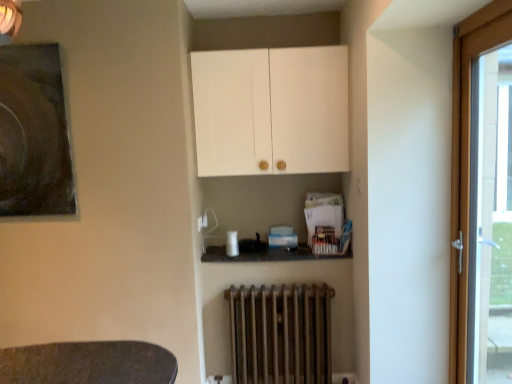
Measure the distance between dark matte painting at upper left and camera.

The distance of dark matte painting at upper left from camera is 7.33 feet.

In order to face rusty metal radiator at lower center, should I rotate leftwards or rightwards?

To align with it, rotate right about 3.390°.

What do you see at coordinates (281, 334) in the screenshot?
I see `rusty metal radiator at lower center` at bounding box center [281, 334].

Image resolution: width=512 pixels, height=384 pixels. What do you see at coordinates (271, 111) in the screenshot?
I see `white matte cabinet at upper center` at bounding box center [271, 111].

Image resolution: width=512 pixels, height=384 pixels. Identify the location of dark matte painting at upper left. (34, 134).

Is white matte cabinet at upper center facing towards dark matte painting at upper left?

No, white matte cabinet at upper center is not facing towards dark matte painting at upper left.

Would you say dark matte painting at upper left is part of white matte cabinet at upper center's contents?

No, dark matte painting at upper left is not surrounded by white matte cabinet at upper center.

From a real-world perspective, does white matte cabinet at upper center stand above dark matte painting at upper left?

Yes.

From the image's perspective, is white matte cabinet at upper center positioned above or below dark matte painting at upper left?

white matte cabinet at upper center is situated higher than dark matte painting at upper left in the image.

Is white matte cabinet at upper center positioned with its back to rusty metal radiator at lower center?

No, white matte cabinet at upper center is not facing the opposite direction of rusty metal radiator at lower center.

Where is `cabinetry above the rusty metal radiator at lower center (from the image's perspective)`? The height and width of the screenshot is (384, 512). cabinetry above the rusty metal radiator at lower center (from the image's perspective) is located at coordinates (271, 111).

Is white matte cabinet at upper center bigger than rusty metal radiator at lower center?

Indeed, white matte cabinet at upper center has a larger size compared to rusty metal radiator at lower center.

Based on the photo, which of these two, white matte cabinet at upper center or rusty metal radiator at lower center, is thinner?

Thinner between the two is rusty metal radiator at lower center.

Does rusty metal radiator at lower center contain wooden door at right?

No, wooden door at right is not a part of rusty metal radiator at lower center.

Which is more to the right, rusty metal radiator at lower center or wooden door at right?

Positioned to the right is wooden door at right.

Does white matte cabinet at upper center turn towards wooden door at right?

No, white matte cabinet at upper center is not aimed at wooden door at right.

From the picture: Are white matte cabinet at upper center and wooden door at right located far from each other?

They are positioned close to each other.

Between white matte cabinet at upper center and wooden door at right, which one has more height?

wooden door at right is taller.

From a real-world perspective, is dark matte painting at upper left located higher than wooden door at right?

Yes.

How different are the orientations of dark matte painting at upper left and wooden door at right in degrees?

There is a 87.8-degree angle between the facing directions of dark matte painting at upper left and wooden door at right.

Considering the positions of objects dark matte painting at upper left and wooden door at right in the image provided, who is more to the right, dark matte painting at upper left or wooden door at right?

wooden door at right.

Locate an element on the screen. door below the dark matte painting at upper left (from a real-world perspective) is located at coordinates (462, 103).

Which of these two, wooden door at right or rusty metal radiator at lower center, is smaller?

rusty metal radiator at lower center is smaller.

Is rusty metal radiator at lower center located within wooden door at right?

No, wooden door at right does not contain rusty metal radiator at lower center.

How different are the orientations of wooden door at right and rusty metal radiator at lower center in degrees?

wooden door at right and rusty metal radiator at lower center are facing 88.2 degrees away from each other.

Is wooden door at right placed right next to rusty metal radiator at lower center?

They are not placed beside each other.

From the picture: From a real-world perspective, is wooden door at right beneath dark matte painting at upper left?

Indeed, from a real-world perspective, wooden door at right is positioned beneath dark matte painting at upper left.

Is wooden door at right facing towards dark matte painting at upper left?

Yes, wooden door at right is turned towards dark matte painting at upper left.

Is wooden door at right bigger or smaller than dark matte painting at upper left?

Clearly, wooden door at right is larger in size than dark matte painting at upper left.

At what (x,y) coordinates should I click in order to perform the action: click on cabinetry that is above the dark matte painting at upper left (from the image's perspective). Please return your answer as a coordinate pair (x, y). This screenshot has width=512, height=384. Looking at the image, I should click on (271, 111).

You are a GUI agent. You are given a task and a screenshot of the screen. Output one action in this format:
    pyautogui.click(x=<x>, y=<y>)
    Task: Click on the radiator behind the white matte cabinet at upper center
    Image resolution: width=512 pixels, height=384 pixels.
    Given the screenshot: What is the action you would take?
    pyautogui.click(x=281, y=334)

Considering their positions, is dark matte painting at upper left positioned further to white matte cabinet at upper center than wooden door at right?

dark matte painting at upper left lies further to white matte cabinet at upper center than the other object.

From the image, which object appears to be farther from wooden door at right, dark matte painting at upper left or rusty metal radiator at lower center?

dark matte painting at upper left is further to wooden door at right.

Which object lies nearer to the anchor point white matte cabinet at upper center, rusty metal radiator at lower center or wooden door at right?

Based on the image, wooden door at right appears to be nearer to white matte cabinet at upper center.

From the picture: Estimate the real-world distances between objects in this image. Which object is closer to white matte cabinet at upper center, wooden door at right or rusty metal radiator at lower center?

Among the two, wooden door at right is located nearer to white matte cabinet at upper center.

When comparing their distances from wooden door at right, does dark matte painting at upper left or white matte cabinet at upper center seem further?

The object further to wooden door at right is dark matte painting at upper left.

From the image, which object appears to be nearer to dark matte painting at upper left, wooden door at right or white matte cabinet at upper center?

Based on the image, white matte cabinet at upper center appears to be nearer to dark matte painting at upper left.

Considering their positions, is wooden door at right positioned further to rusty metal radiator at lower center than dark matte painting at upper left?

dark matte painting at upper left lies further to rusty metal radiator at lower center than the other object.

Which object lies nearer to the anchor point wooden door at right, rusty metal radiator at lower center or dark matte painting at upper left?

Among the two, rusty metal radiator at lower center is located nearer to wooden door at right.

Locate an element on the screen. This screenshot has height=384, width=512. radiator between dark matte painting at upper left and wooden door at right in the horizontal direction is located at coordinates (281, 334).

Locate an element on the screen. cabinetry situated between dark matte painting at upper left and rusty metal radiator at lower center from left to right is located at coordinates (271, 111).

Image resolution: width=512 pixels, height=384 pixels. Find the location of `cabinetry between dark matte painting at upper left and wooden door at right from left to right`. cabinetry between dark matte painting at upper left and wooden door at right from left to right is located at coordinates (271, 111).

What are the coordinates of `door that lies between white matte cabinet at upper center and rusty metal radiator at lower center from top to bottom` in the screenshot? It's located at (462, 103).